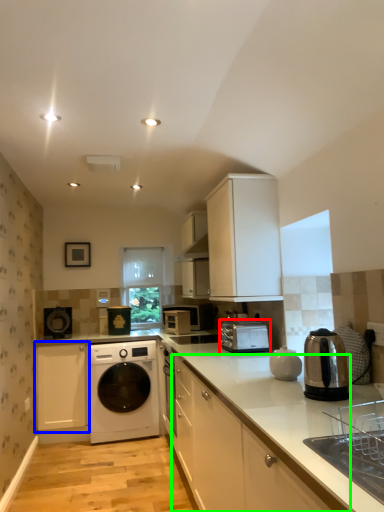
Question: Estimate the real-world distances between objects in this image. Which object is farther from home appliance (highlighted by a red box), cabinetry (highlighted by a blue box) or cabinetry (highlighted by a green box)?

Choices:
 (A) cabinetry
 (B) cabinetry

Answer: (A)